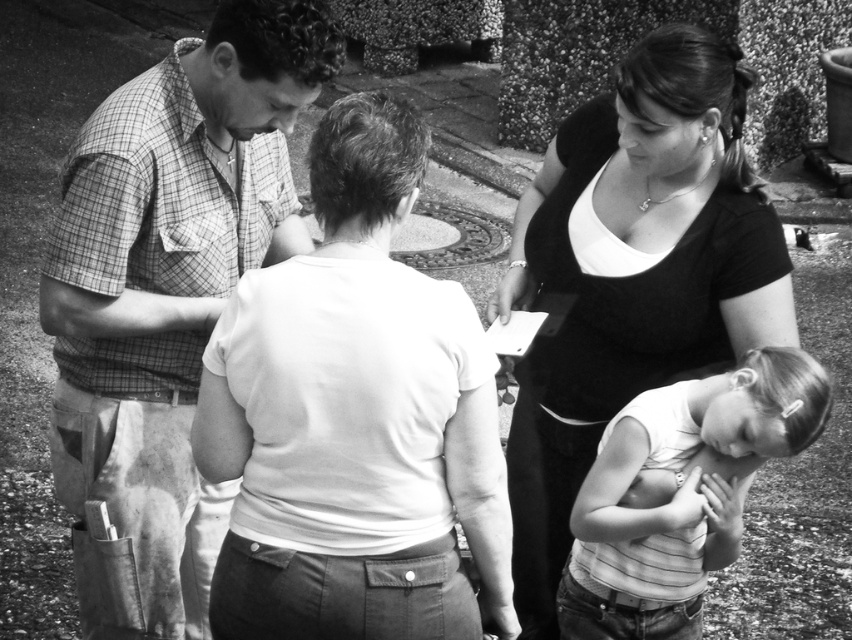
You are a photographer trying to capture a group photo of the checkered fabric shirt at left and the matte black shirt at center. Given that your camera can only focus on subjects within a 1.2 meter range, will both individuals be in focus?

The distance between the checkered fabric shirt at left and the matte black shirt at center is 1.04 meters, which is within the camera focus range of 1.2 meters. Therefore, both individuals will be in focus.

In the scene described, there are two people wearing different tops. The first person is wearing a matte black shirt at center, and the second is wearing a white striped tank top at lower right. From the perspective of someone standing at the front of the image, which top is positioned higher?

The matte black shirt at center is positioned higher than the white striped tank top at lower right.

You are a photographer trying to capture a candid shot of both the checkered fabric shirt at left and the white striped tank top at lower right. Since you want to ensure both are in focus, which individual should you adjust your camera focus on first?

You should focus on the checkered fabric shirt at left first because it is closer to you than the white striped tank top at lower right, so adjusting focus starting from the closer subject ensures both can be in focus.